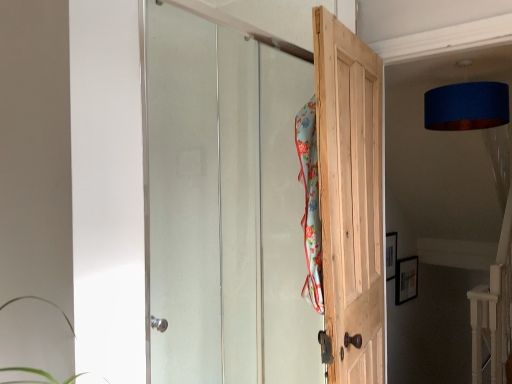
Locate an element on the screen. floral fabric beach towel at center is located at coordinates (310, 202).

I want to click on clear glass door at upper center, arranged as the first door when viewed from the left, so click(x=226, y=206).

Describe the element at coordinates (226, 206) in the screenshot. I see `clear glass door at upper center, the second door when ordered from right to left` at that location.

Measure the distance between natural wood door at center, which appears as the 2th door when viewed from the left, and camera.

natural wood door at center, which appears as the 2th door when viewed from the left, is 4.78 feet away from camera.

Locate an element on the screen. blue fabric lampshade at upper right is located at coordinates 467,106.

At what (x,y) coordinates should I click in order to perform the action: click on floral fabric beach towel at center. Please return your answer as a coordinate pair (x, y). This screenshot has width=512, height=384. Looking at the image, I should click on (310, 202).

Considering the sizes of natural wood door at center, which appears as the 2th door when viewed from the left, and blue fabric lampshade at upper right in the image, is natural wood door at center, which appears as the 2th door when viewed from the left, wider or thinner than blue fabric lampshade at upper right?

Clearly, natural wood door at center, which appears as the 2th door when viewed from the left, has less width compared to blue fabric lampshade at upper right.

How different are the orientations of natural wood door at center, arranged as the first door when viewed from the right, and blue fabric lampshade at upper right in degrees?

101 degrees separate the facing orientations of natural wood door at center, arranged as the first door when viewed from the right, and blue fabric lampshade at upper right.

Measure the distance from natural wood door at center, which appears as the 2th door when viewed from the left, to blue fabric lampshade at upper right.

natural wood door at center, which appears as the 2th door when viewed from the left, and blue fabric lampshade at upper right are 33.78 inches apart.

From the image's perspective, is natural wood door at center, arranged as the first door when viewed from the right, located beneath blue fabric lampshade at upper right?

Yes.

Is blue fabric lampshade at upper right completely or partially outside of natural wood door at center, arranged as the first door when viewed from the right?

blue fabric lampshade at upper right lies outside natural wood door at center, arranged as the first door when viewed from the right,'s area.

Is point (498, 118) less distant than point (333, 126)?

No, (498, 118) is behind (333, 126).

Is the surface of blue fabric lampshade at upper right in direct contact with natural wood door at center, which appears as the 2th door when viewed from the left?

blue fabric lampshade at upper right and natural wood door at center, which appears as the 2th door when viewed from the left, are clearly separated.

How different are the orientations of blue fabric lampshade at upper right and natural wood door at center, arranged as the first door when viewed from the right, in degrees?

101 degrees.

Is point (380, 271) closer to camera compared to point (312, 216)?

No, (380, 271) is further to viewer.

Looking at this image, is floral fabric beach towel at center at the back of natural wood door at center, which appears as the 2th door when viewed from the left?

Yes, natural wood door at center, which appears as the 2th door when viewed from the left,'s orientation is away from floral fabric beach towel at center.

In the image, is natural wood door at center, which appears as the 2th door when viewed from the left, on the left side or the right side of floral fabric beach towel at center?

Based on their positions, natural wood door at center, which appears as the 2th door when viewed from the left, is located to the right of floral fabric beach towel at center.

Between natural wood door at center, which appears as the 2th door when viewed from the left, and floral fabric beach towel at center, which one has less height?

floral fabric beach towel at center is shorter.

Considering the sizes of floral fabric beach towel at center and natural wood door at center, arranged as the first door when viewed from the right, in the image, is floral fabric beach towel at center taller or shorter than natural wood door at center, arranged as the first door when viewed from the right,?

Clearly, floral fabric beach towel at center is shorter compared to natural wood door at center, arranged as the first door when viewed from the right.

From a real-world perspective, relative to natural wood door at center, arranged as the first door when viewed from the right, is floral fabric beach towel at center vertically above or below?

Clearly, from a real-world perspective, floral fabric beach towel at center is above natural wood door at center, arranged as the first door when viewed from the right.

From the image's perspective, is floral fabric beach towel at center beneath natural wood door at center, arranged as the first door when viewed from the right?

No.

From a real-world perspective, who is located lower, clear glass door at upper center, the second door when ordered from right to left, or floral fabric beach towel at center?

clear glass door at upper center, the second door when ordered from right to left, is physically lower.

Do you think clear glass door at upper center, the second door when ordered from right to left, is within floral fabric beach towel at center, or outside of it?

clear glass door at upper center, the second door when ordered from right to left, is spatially situated outside floral fabric beach towel at center.

From the image's perspective, is clear glass door at upper center, arranged as the first door when viewed from the left, located above floral fabric beach towel at center?

No, from the image's perspective, clear glass door at upper center, arranged as the first door when viewed from the left, is not above floral fabric beach towel at center.

This screenshot has width=512, height=384. In order to click on beach towel that is above the clear glass door at upper center, arranged as the first door when viewed from the left (from a real-world perspective) in this screenshot , I will do tap(310, 202).

The image size is (512, 384). Find the location of `door lying above the natural wood door at center, which appears as the 2th door when viewed from the left (from the image's perspective)`. door lying above the natural wood door at center, which appears as the 2th door when viewed from the left (from the image's perspective) is located at coordinates (226, 206).

Is clear glass door at upper center, the second door when ordered from right to left, taller or shorter than natural wood door at center, which appears as the 2th door when viewed from the left?

Clearly, clear glass door at upper center, the second door when ordered from right to left, is shorter compared to natural wood door at center, which appears as the 2th door when viewed from the left.

Does clear glass door at upper center, arranged as the first door when viewed from the left, have a lesser width compared to natural wood door at center, arranged as the first door when viewed from the right?

Indeed, clear glass door at upper center, arranged as the first door when viewed from the left, has a lesser width compared to natural wood door at center, arranged as the first door when viewed from the right.

Does floral fabric beach towel at center have a larger size compared to clear glass door at upper center, arranged as the first door when viewed from the left?

No.

Which object is thinner, floral fabric beach towel at center or clear glass door at upper center, arranged as the first door when viewed from the left?

clear glass door at upper center, arranged as the first door when viewed from the left, is thinner.

Is floral fabric beach towel at center to the right of clear glass door at upper center, the second door when ordered from right to left, from the viewer's perspective?

Yes.

From the image's perspective, count 2nd doors downward from the blue fabric lampshade at upper right and point to it. Please provide its 2D coordinates.

[(350, 199)]

Find the location of a particular element. This screenshot has width=512, height=384. lamp on the right of natural wood door at center, arranged as the first door when viewed from the right is located at coordinates (467, 106).

Looking at the image, which one is located closer to natural wood door at center, which appears as the 2th door when viewed from the left, clear glass door at upper center, the second door when ordered from right to left, or blue fabric lampshade at upper right?

Based on the image, clear glass door at upper center, the second door when ordered from right to left, appears to be nearer to natural wood door at center, which appears as the 2th door when viewed from the left.

Which object lies further to the anchor point blue fabric lampshade at upper right, natural wood door at center, arranged as the first door when viewed from the right, or floral fabric beach towel at center?

Among the two, floral fabric beach towel at center is located further to blue fabric lampshade at upper right.

Looking at the image, which one is located closer to floral fabric beach towel at center, clear glass door at upper center, arranged as the first door when viewed from the left, or blue fabric lampshade at upper right?

clear glass door at upper center, arranged as the first door when viewed from the left, is positioned closer to the anchor floral fabric beach towel at center.

Based on the photo, estimate the real-world distances between objects in this image. Which object is further from blue fabric lampshade at upper right, natural wood door at center, arranged as the first door when viewed from the right, or clear glass door at upper center, arranged as the first door when viewed from the left?

Among the two, clear glass door at upper center, arranged as the first door when viewed from the left, is located further to blue fabric lampshade at upper right.

Estimate the real-world distances between objects in this image. Which object is further from clear glass door at upper center, the second door when ordered from right to left, natural wood door at center, which appears as the 2th door when viewed from the left, or floral fabric beach towel at center?

floral fabric beach towel at center lies further to clear glass door at upper center, the second door when ordered from right to left, than the other object.

Which object lies further to the anchor point natural wood door at center, arranged as the first door when viewed from the right, floral fabric beach towel at center or blue fabric lampshade at upper right?

Among the two, blue fabric lampshade at upper right is located further to natural wood door at center, arranged as the first door when viewed from the right.

Looking at the image, which one is located further to clear glass door at upper center, the second door when ordered from right to left, natural wood door at center, arranged as the first door when viewed from the right, or blue fabric lampshade at upper right?

blue fabric lampshade at upper right lies further to clear glass door at upper center, the second door when ordered from right to left, than the other object.

Considering their positions, is floral fabric beach towel at center positioned closer to blue fabric lampshade at upper right than natural wood door at center, which appears as the 2th door when viewed from the left?

natural wood door at center, which appears as the 2th door when viewed from the left, is closer to blue fabric lampshade at upper right.

Locate an element on the screen. The width and height of the screenshot is (512, 384). door between clear glass door at upper center, the second door when ordered from right to left, and blue fabric lampshade at upper right from left to right is located at coordinates (350, 199).

Where is `beach towel situated between clear glass door at upper center, the second door when ordered from right to left, and blue fabric lampshade at upper right from left to right`? beach towel situated between clear glass door at upper center, the second door when ordered from right to left, and blue fabric lampshade at upper right from left to right is located at coordinates (310, 202).

Where is `beach towel situated between clear glass door at upper center, arranged as the first door when viewed from the left, and natural wood door at center, which appears as the 2th door when viewed from the left, from left to right`? This screenshot has width=512, height=384. beach towel situated between clear glass door at upper center, arranged as the first door when viewed from the left, and natural wood door at center, which appears as the 2th door when viewed from the left, from left to right is located at coordinates (310, 202).

The image size is (512, 384). In order to click on door located between floral fabric beach towel at center and blue fabric lampshade at upper right in the left-right direction in this screenshot , I will do `click(350, 199)`.